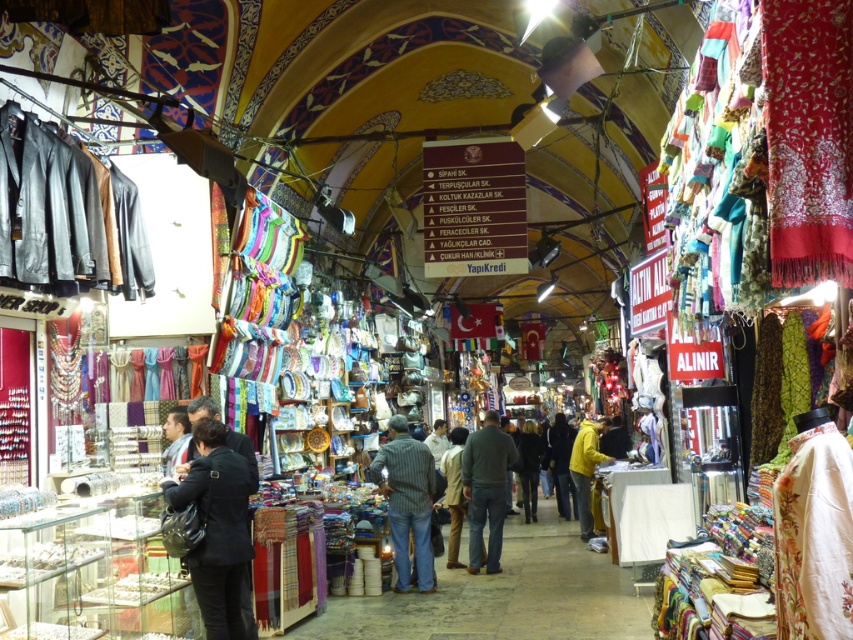
You are standing in the market and want to locate two specific points. The first point is at coordinates point (213, 611) and the second is at point (457, 467). Which of these points is nearer to you?

Point (213, 611) is closer to the viewer than point (457, 467).

You are a vendor at the market and want to display both the dark blue fabric at center and the light brown leather jacket at center on a single shelf. The shelf has a maximum width of 1.2 meters. Can both items fit side by side?

The dark blue fabric at center is wider than the light brown leather jacket at center. However, since the shelf has a maximum width of 1.2 meters, both items can only fit if their combined widths do not exceed this limit. Unfortunately, the exact widths are not provided, so it is impossible to determine definitively.